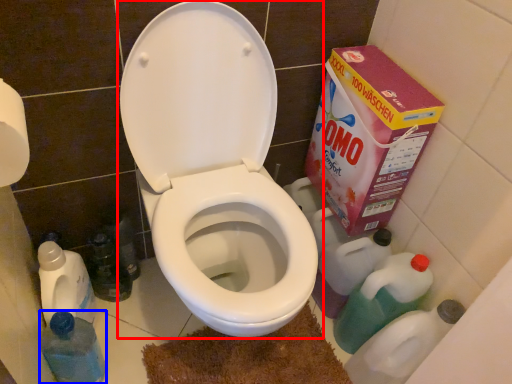
Question: Which object is further to the camera taking this photo, toilet (highlighted by a red box) or bottle (highlighted by a blue box)?

Choices:
 (A) toilet
 (B) bottle

Answer: (B)